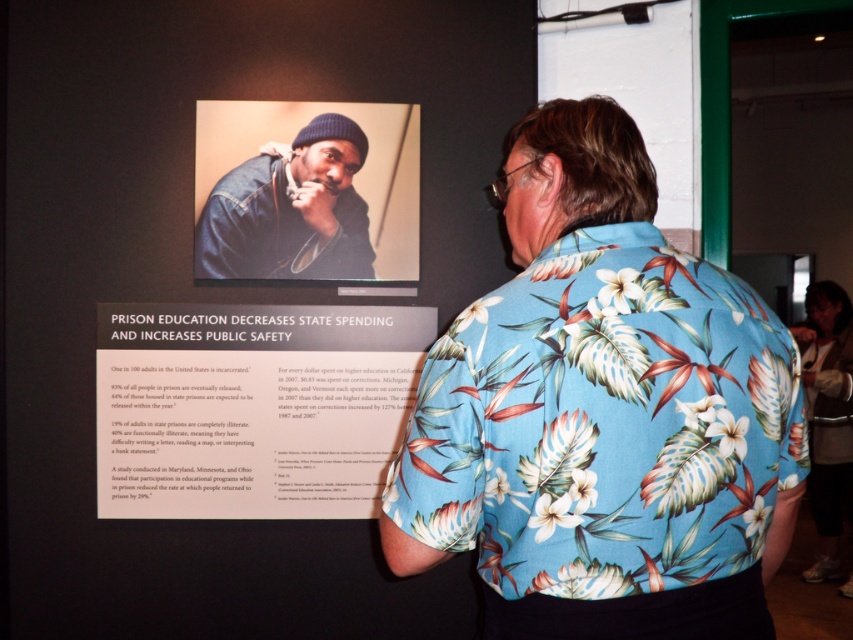
Does blue floral print shirt at upper center have a lesser height compared to matte paper poster at center?

Yes, blue floral print shirt at upper center is shorter than matte paper poster at center.

Is blue floral print shirt at upper center positioned in front of matte paper poster at center?

Yes.

Is point (795, 388) behind point (318, 326)?

No, it is not.

You are a GUI agent. You are given a task and a screenshot of the screen. Output one action in this format:
    pyautogui.click(x=<x>, y=<y>)
    Task: Click on the blue floral print shirt at upper center
    The image size is (853, 640).
    Given the screenshot: What is the action you would take?
    pyautogui.click(x=602, y=424)

Between point (747, 317) and point (329, 234), which one is positioned in front?

Point (747, 317)

Is point (619, 499) closer to camera compared to point (225, 275)?

Yes, it is in front of point (225, 275).

Identify the location of blue floral print shirt at upper center. (602, 424).

Who is positioned more to the right, matte paper poster at center or floral print shirt at center?

floral print shirt at center is more to the right.

Is the position of matte paper poster at center more distant than that of floral print shirt at center?

No, matte paper poster at center is in front of floral print shirt at center.

The height and width of the screenshot is (640, 853). Identify the location of matte paper poster at center. (251, 406).

You are a GUI agent. You are given a task and a screenshot of the screen. Output one action in this format:
    pyautogui.click(x=<x>, y=<y>)
    Task: Click on the matte paper poster at center
    The width and height of the screenshot is (853, 640).
    Given the screenshot: What is the action you would take?
    [251, 406]